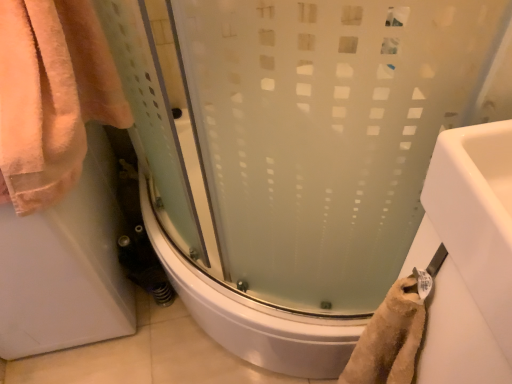
Identify the location of frosted glass shower door at center. This screenshot has height=384, width=512. (327, 132).

This screenshot has height=384, width=512. Describe the element at coordinates (327, 132) in the screenshot. I see `frosted glass shower door at center` at that location.

The width and height of the screenshot is (512, 384). Describe the element at coordinates (52, 96) in the screenshot. I see `pink terry cloth towel at left` at that location.

Find the location of a particular element. pink terry cloth towel at left is located at coordinates (52, 96).

Where is `frosted glass shower door at center`? frosted glass shower door at center is located at coordinates (327, 132).

Is frosted glass shower door at center to the right of pink terry cloth towel at left from the viewer's perspective?

Yes.

Considering the positions of objects frosted glass shower door at center and pink terry cloth towel at left in the image provided, who is behind, frosted glass shower door at center or pink terry cloth towel at left?

frosted glass shower door at center is further away from the camera.

Looking at this image, which point is more distant from viewer, [302,174] or [41,154]?

The point [41,154] is behind.

From the image's perspective, between frosted glass shower door at center and pink terry cloth towel at left, who is located below?

From the image's view, frosted glass shower door at center is below.

Looking at this image, from a real-world perspective, is frosted glass shower door at center below pink terry cloth towel at left?

Yes, from a real-world perspective, frosted glass shower door at center is below pink terry cloth towel at left.

Looking at their sizes, would you say frosted glass shower door at center is wider or thinner than pink terry cloth towel at left?

Clearly, frosted glass shower door at center has more width compared to pink terry cloth towel at left.

Is frosted glass shower door at center shorter than pink terry cloth towel at left?

Yes.

Considering the sizes of frosted glass shower door at center and pink terry cloth towel at left in the image, is frosted glass shower door at center bigger or smaller than pink terry cloth towel at left?

Clearly, frosted glass shower door at center is larger in size than pink terry cloth towel at left.

Is frosted glass shower door at center spatially inside pink terry cloth towel at left, or outside of it?

frosted glass shower door at center is not enclosed by pink terry cloth towel at left.

Is frosted glass shower door at center far away from pink terry cloth towel at left?

No.

Is frosted glass shower door at center positioned with its back to pink terry cloth towel at left?

frosted glass shower door at center does not have its back to pink terry cloth towel at left.

What's the angular difference between frosted glass shower door at center and pink terry cloth towel at left's facing directions?

91.3 degrees separate the facing orientations of frosted glass shower door at center and pink terry cloth towel at left.

Locate an element on the screen. The image size is (512, 384). towel above the frosted glass shower door at center (from the image's perspective) is located at coordinates (52, 96).

Consider the image. Considering the relative positions of pink terry cloth towel at left and frosted glass shower door at center in the image provided, is pink terry cloth towel at left to the right of frosted glass shower door at center from the viewer's perspective?

Incorrect, pink terry cloth towel at left is not on the right side of frosted glass shower door at center.

Between pink terry cloth towel at left and frosted glass shower door at center, which one is positioned behind?

frosted glass shower door at center is behind.

Based on the photo, which is closer to the camera, [80,82] or [267,196]?

Positioned in front is point [267,196].

From the picture: From the image's perspective, would you say pink terry cloth towel at left is shown under frosted glass shower door at center?

No.

From a real-world perspective, is pink terry cloth towel at left above or below frosted glass shower door at center?

pink terry cloth towel at left is above frosted glass shower door at center.

Which object is thinner, pink terry cloth towel at left or frosted glass shower door at center?

pink terry cloth towel at left.

Considering the sizes of pink terry cloth towel at left and frosted glass shower door at center in the image, is pink terry cloth towel at left taller or shorter than frosted glass shower door at center?

In the image, pink terry cloth towel at left appears to be taller than frosted glass shower door at center.

Is pink terry cloth towel at left bigger than frosted glass shower door at center?

No, pink terry cloth towel at left is not bigger than frosted glass shower door at center.

Is pink terry cloth towel at left completely or partially outside of frosted glass shower door at center?

That's correct, pink terry cloth towel at left is outside of frosted glass shower door at center.

Is pink terry cloth towel at left in contact with frosted glass shower door at center?

No.

Could you tell me if pink terry cloth towel at left is facing frosted glass shower door at center?

No, pink terry cloth towel at left is not turned towards frosted glass shower door at center.

How different are the orientations of pink terry cloth towel at left and frosted glass shower door at center in degrees?

91.3 degrees separate the facing orientations of pink terry cloth towel at left and frosted glass shower door at center.

How distant is pink terry cloth towel at left from frosted glass shower door at center?

The distance of pink terry cloth towel at left from frosted glass shower door at center is 14.37 inches.

Identify the location of towel lying on the left of frosted glass shower door at center. The width and height of the screenshot is (512, 384). (52, 96).

This screenshot has width=512, height=384. In the image, there is a pink terry cloth towel at left. Find the location of `shower door below it (from a real-world perspective)`. shower door below it (from a real-world perspective) is located at coordinates (x=327, y=132).

Where is `towel located above the frosted glass shower door at center (from the image's perspective)`? This screenshot has width=512, height=384. towel located above the frosted glass shower door at center (from the image's perspective) is located at coordinates (52, 96).